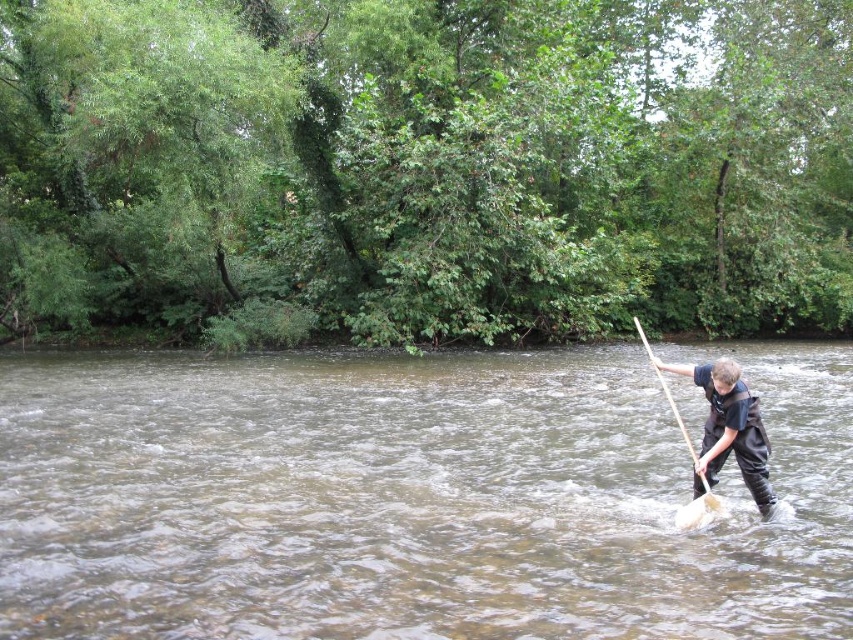
You are a hiker trying to cross the river using the dark blue fabric at right and the wooden paddle at right. Which item is positioned lower relative to the other?

The dark blue fabric at right is located below the wooden paddle at right, so it is positioned lower.

You are a hiker who needs to cross the river safely. You see the brown muddy water at center and the dark blue fabric at right. Which object is closer to you, and why?

The brown muddy water at center is closer to you because it is positioned in front of the dark blue fabric at right, making it the nearer object in the scene.

You are standing on the riverbank and want to cross the river using a 5 meter long rope bridge. The brown muddy water at center is in your path. Is the bridge long enough to span the river at that point?

The brown muddy water at center is 4.87 meters away from viewer. Since the bridge is 5 meters long, it is just long enough to span the river at that point.